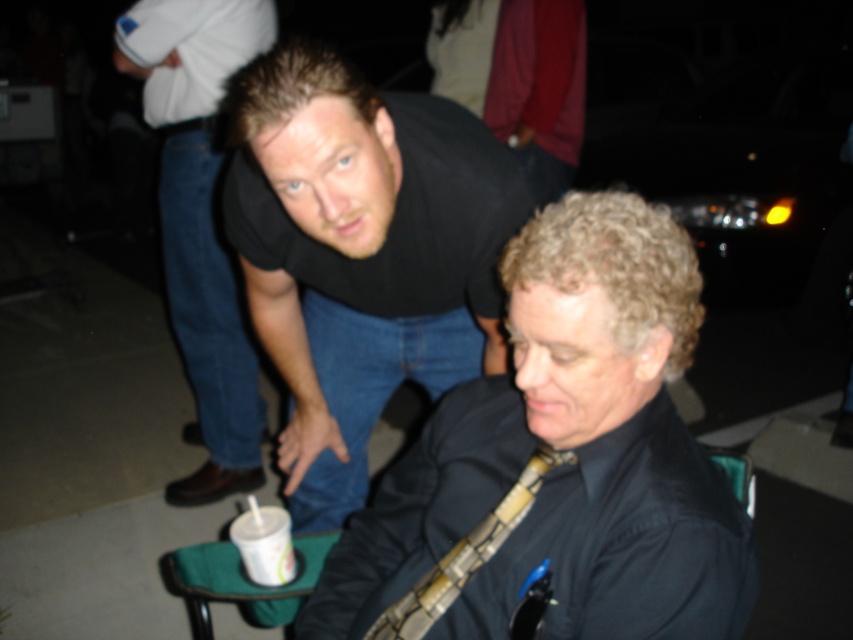
Question: Is black matte shirt at upper center further to camera compared to patterned silk tie at lower center?

Choices:
 (A) yes
 (B) no

Answer: (A)

Question: Which point appears farthest from the camera in this image?

Choices:
 (A) (567, 372)
 (B) (299, 381)
 (C) (244, 563)

Answer: (B)

Question: Which point appears closest to the camera in this image?

Choices:
 (A) (189, 355)
 (B) (245, 516)
 (C) (659, 442)

Answer: (C)

Question: Is black matte shirt at upper center positioned behind black cotton shirt at upper center?

Choices:
 (A) no
 (B) yes

Answer: (A)

Question: Is black matte shirt at upper center wider than patterned silk tie at lower center?

Choices:
 (A) yes
 (B) no

Answer: (A)

Question: Estimate the real-world distances between objects in this image. Which object is closer to the white paper cup at lower left?

Choices:
 (A) matte black shirt at upper center
 (B) patterned silk tie at lower center
 (C) black cotton shirt at upper center

Answer: (B)